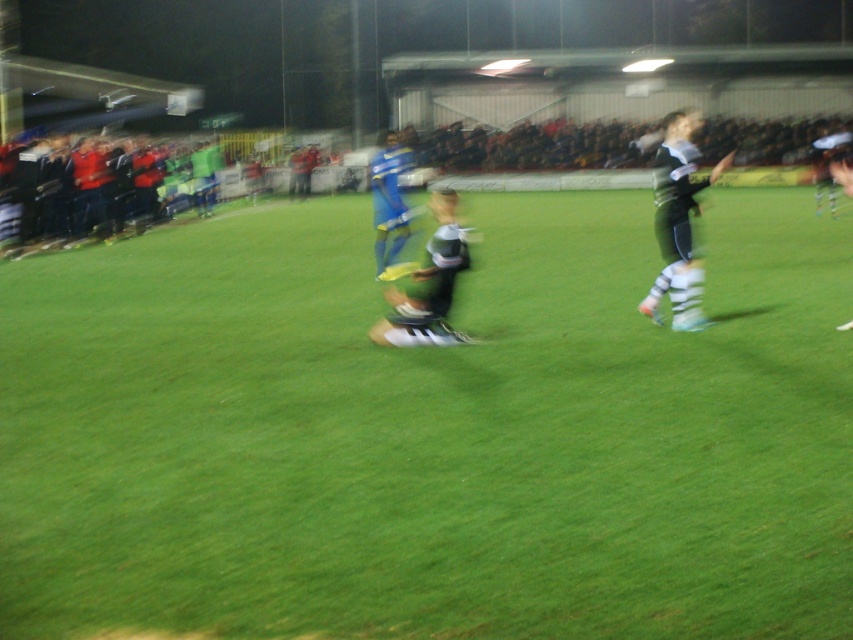
Does dark green jersey at right have a smaller size compared to green jersey at center?

Incorrect, dark green jersey at right is not smaller in size than green jersey at center.

Is dark green jersey at right shorter than green jersey at center?

No.

The height and width of the screenshot is (640, 853). I want to click on dark green jersey at right, so click(677, 225).

Can you confirm if green grass at center is taller than dark green jersey at right?

No, green grass at center is not taller than dark green jersey at right.

Which of these two, green grass at center or dark green jersey at right, stands taller?

dark green jersey at right

Measure the distance between point (494,332) and camera.

The distance of point (494,332) from camera is 34.95 feet.

I want to click on green grass at center, so click(x=430, y=432).

Is point (662, 493) more distant than point (444, 244)?

No, it is in front of (444, 244).

Who is more distant from viewer, (459, 464) or (428, 282)?

The point (428, 282) is behind.

Where is `green grass at center`? The height and width of the screenshot is (640, 853). green grass at center is located at coordinates (430, 432).